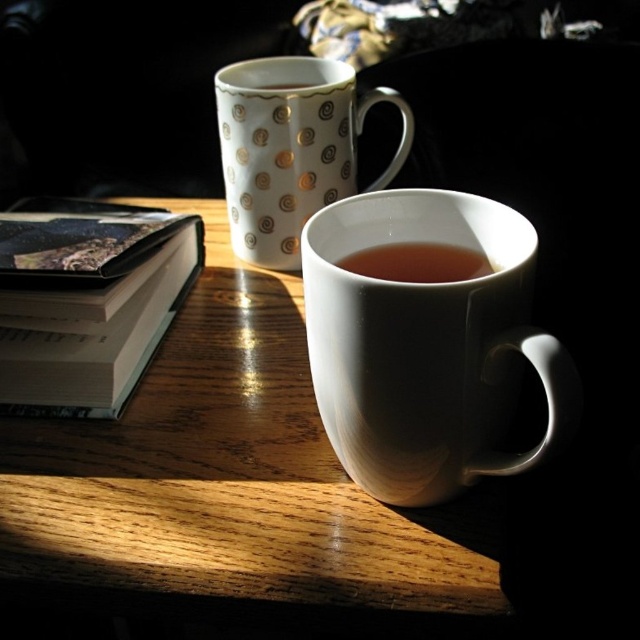
Between hardcover book at left and translucent glass cup at center, which one is positioned higher?

hardcover book at left

What do you see at coordinates (92, 307) in the screenshot?
I see `hardcover book at left` at bounding box center [92, 307].

Is point (16, 401) positioned after point (474, 276)?

Yes, it is.

This screenshot has height=640, width=640. What are the coordinates of `hardcover book at left` in the screenshot? It's located at (92, 307).

Is point (372, 273) closer to camera compared to point (312, 83)?

Yes.

Can you confirm if translucent glass cup at center is wider than gold metallic swirls at upper left?

Correct, the width of translucent glass cup at center exceeds that of gold metallic swirls at upper left.

In order to click on translucent glass cup at center in this screenshot , I will do `click(417, 262)`.

In the scene shown: Does white glossy mug at center have a greater width compared to hardcover book at left?

No, white glossy mug at center is not wider than hardcover book at left.

Where is `white glossy mug at center`? white glossy mug at center is located at coordinates (426, 346).

Does point (435, 339) lie in front of point (58, 214)?

Yes, point (435, 339) is closer to viewer.

You are a GUI agent. You are given a task and a screenshot of the screen. Output one action in this format:
    pyautogui.click(x=<x>, y=<y>)
    Task: Click on the white glossy mug at center
    The width and height of the screenshot is (640, 640).
    Given the screenshot: What is the action you would take?
    pyautogui.click(x=426, y=346)